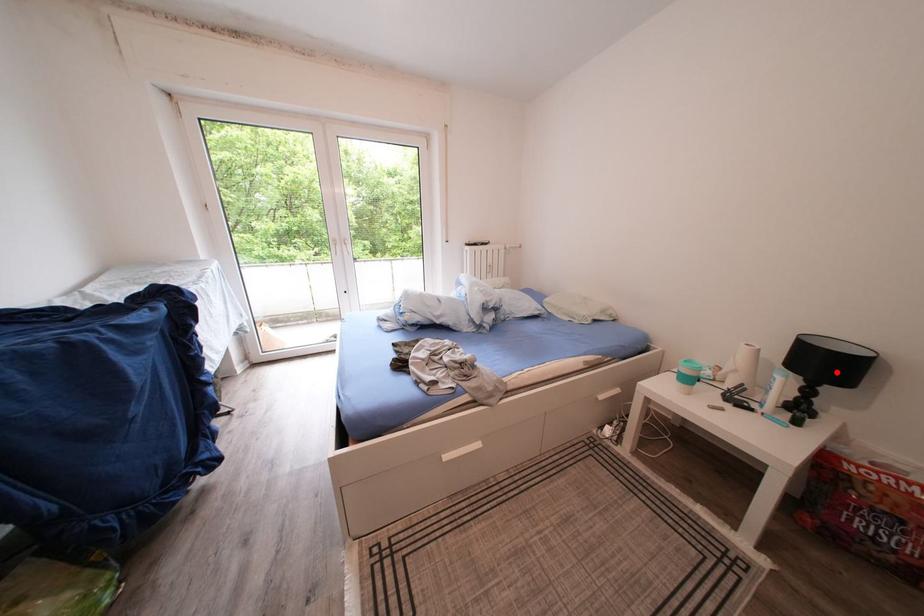
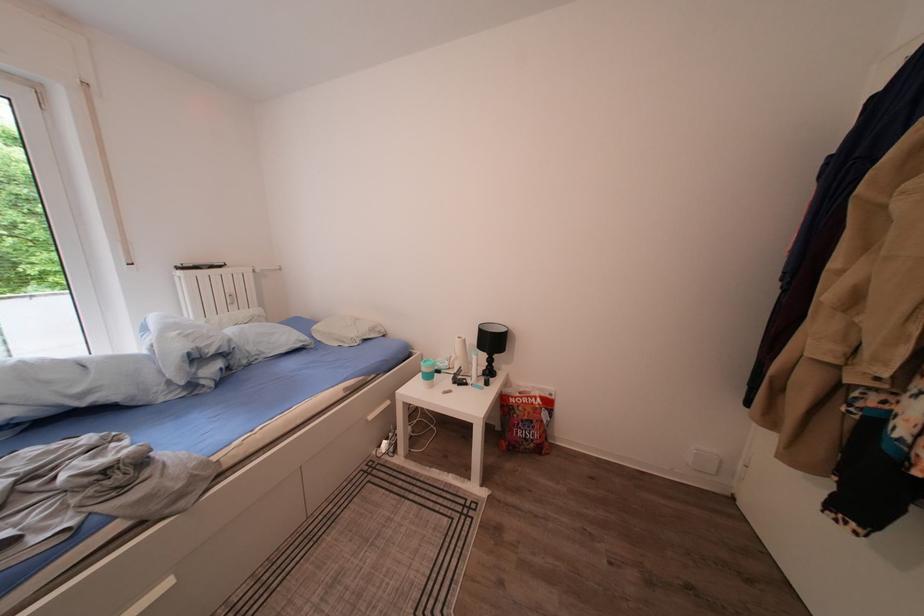
The point at the highlighted location is marked in the first image. Where is the corresponding point in the second image?

(502, 347)